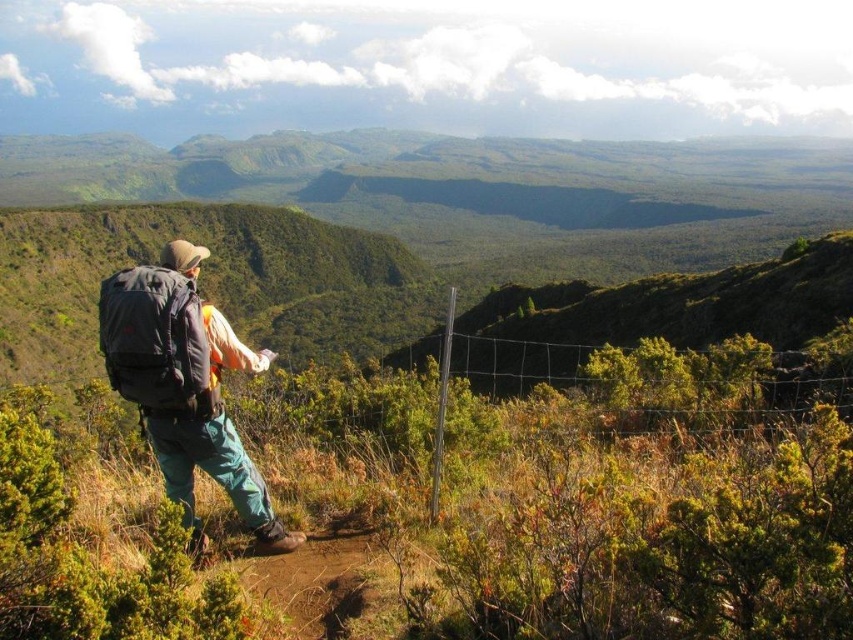
Who is shorter, matte black backpack at center-left or wire mesh fence at center?

Standing shorter between the two is matte black backpack at center-left.

Is point (142, 380) farther from viewer compared to point (437, 461)?

No.

Is point (196, 390) less distant than point (520, 380)?

Yes, it is.

At what (x,y) coordinates should I click in order to perform the action: click on matte black backpack at center-left. Please return your answer as a coordinate pair (x, y). The image size is (853, 640). Looking at the image, I should click on (184, 385).